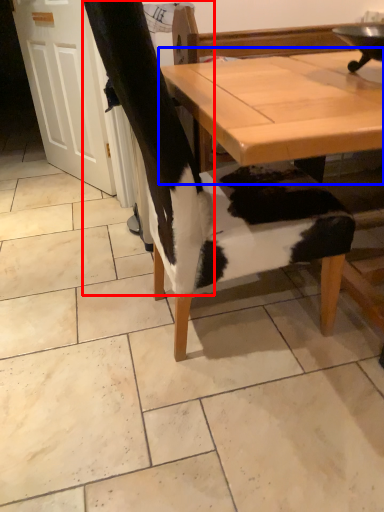
Question: Which object appears farthest to the camera in this image, leg (highlighted by a red box) or table (highlighted by a blue box)?

Choices:
 (A) leg
 (B) table

Answer: (A)